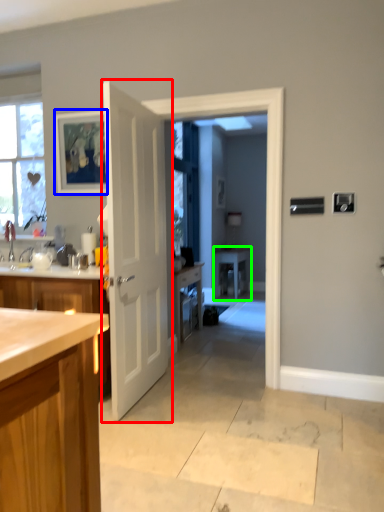
Question: Which object is the farthest from door (highlighted by a red box)? Choose among these: picture frame (highlighted by a blue box) or table (highlighted by a green box).

Choices:
 (A) picture frame
 (B) table

Answer: (B)